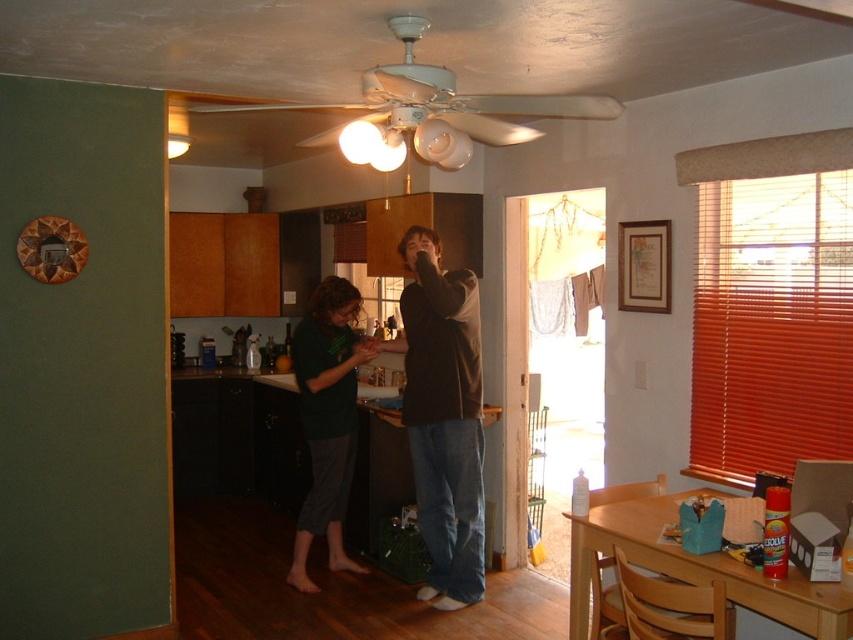
Question: Is white plastic fan at upper center closer to the viewer compared to green matte shirt at center?

Choices:
 (A) yes
 (B) no

Answer: (A)

Question: Does dark green fabric shirt at center have a smaller size compared to brown cotton shirt at center?

Choices:
 (A) no
 (B) yes

Answer: (A)

Question: Can you confirm if white plastic fan at upper center is positioned above green matte shirt at center?

Choices:
 (A) no
 (B) yes

Answer: (B)

Question: Which point is closer to the camera taking this photo?

Choices:
 (A) (454, 458)
 (B) (334, 276)
 (C) (432, 291)

Answer: (C)

Question: Which point is farther from the camera taking this photo?

Choices:
 (A) (440, 314)
 (B) (445, 470)
 (C) (335, 134)

Answer: (B)

Question: Which point is farther from the camera taking this photo?

Choices:
 (A) (474, 328)
 (B) (416, 33)
 (C) (450, 541)

Answer: (C)